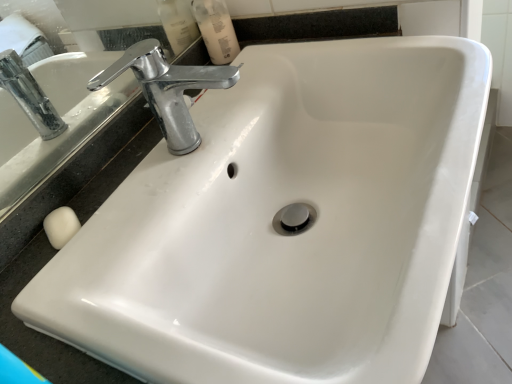
You are a GUI agent. You are given a task and a screenshot of the screen. Output one action in this format:
    pyautogui.click(x=<x>, y=<y>)
    Task: Click on the vacant area that is situated to the right of chrome metallic faucet at upper left
    This screenshot has height=384, width=512.
    Given the screenshot: What is the action you would take?
    pyautogui.click(x=323, y=64)